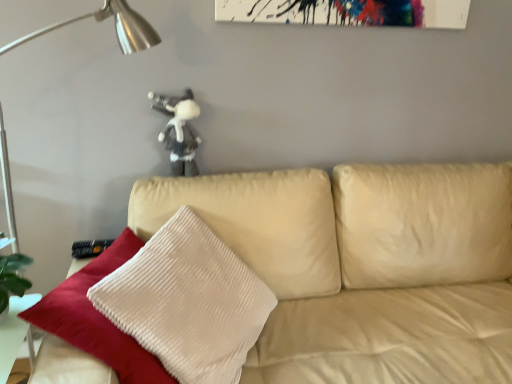
Question: From the image's perspective, is white plush toy at upper center positioned above or below metallic silver table lamp at left?

Choices:
 (A) below
 (B) above

Answer: (B)

Question: From a real-world perspective, relative to metallic silver table lamp at left, is white plush toy at upper center vertically above or below?

Choices:
 (A) below
 (B) above

Answer: (B)

Question: Which of these objects is positioned farthest from the metallic silver table lamp at left?

Choices:
 (A) beige leather couch at center
 (B) white plush toy at upper center

Answer: (A)

Question: Which object is the farthest from the metallic silver table lamp at left?

Choices:
 (A) beige leather couch at center
 (B) white plush toy at upper center

Answer: (A)